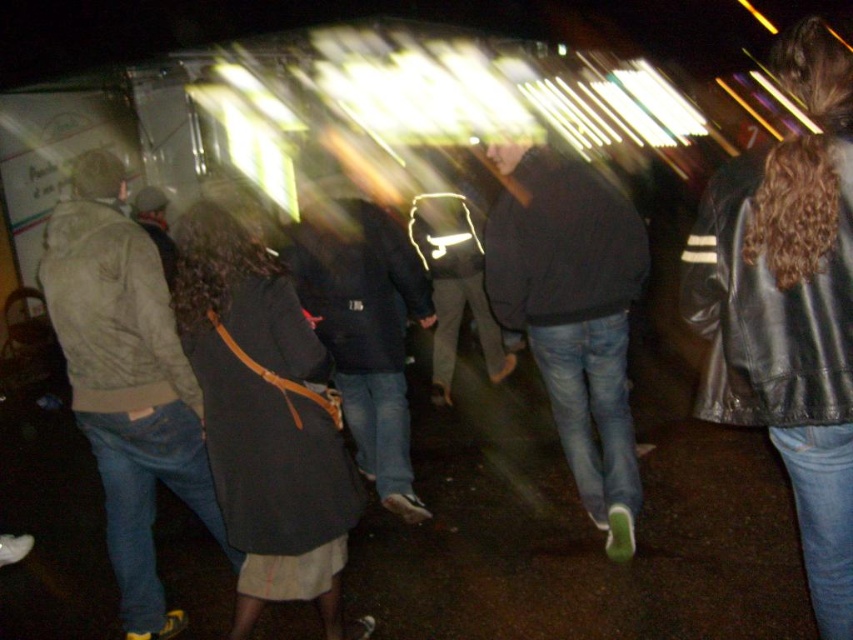
Between dark gray coat at center and light brown leather jacket at left, which one appears on the right side from the viewer's perspective?

Positioned to the right is dark gray coat at center.

Who is more forward, [268,404] or [119,268]?

Point [268,404] is more forward.

Does point (315, 346) come in front of point (112, 444)?

Yes, point (315, 346) is in front of point (112, 444).

Image resolution: width=853 pixels, height=640 pixels. I want to click on dark gray coat at center, so click(x=265, y=420).

Does black leather jacket at right have a lesser width compared to dark blue jacket at center?

Correct, black leather jacket at right's width is less than dark blue jacket at center's.

Who is taller, black leather jacket at right or dark blue jacket at center?

Standing taller between the two is black leather jacket at right.

Between point (741, 177) and point (395, 410), which one is positioned behind?

The point (395, 410) is behind.

What are the coordinates of `black leather jacket at right` in the screenshot? It's located at click(x=788, y=307).

Is light brown leather jacket at left wider than dark blue jacket at center?

No.

Is light brown leather jacket at left to the right of dark blue jacket at center from the viewer's perspective?

In fact, light brown leather jacket at left is to the left of dark blue jacket at center.

Does point (120, 508) come farther from viewer compared to point (325, 196)?

No, it is in front of (325, 196).

The height and width of the screenshot is (640, 853). Identify the location of light brown leather jacket at left. (126, 380).